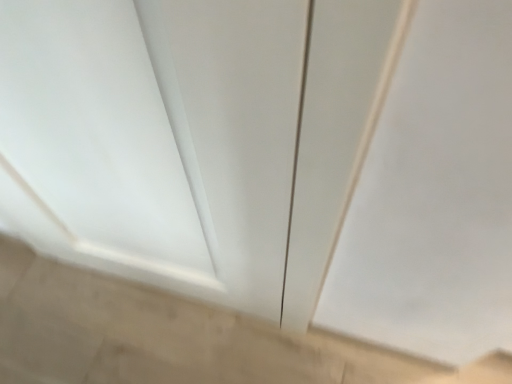
The width and height of the screenshot is (512, 384). What do you see at coordinates (97, 135) in the screenshot?
I see `white glossy door at center` at bounding box center [97, 135].

This screenshot has height=384, width=512. What are the coordinates of `white glossy door at center` in the screenshot? It's located at (97, 135).

You are a GUI agent. You are given a task and a screenshot of the screen. Output one action in this format:
    pyautogui.click(x=<x>, y=<y>)
    Task: Click on the white glossy door at center
    The height and width of the screenshot is (384, 512).
    Given the screenshot: What is the action you would take?
    pyautogui.click(x=97, y=135)